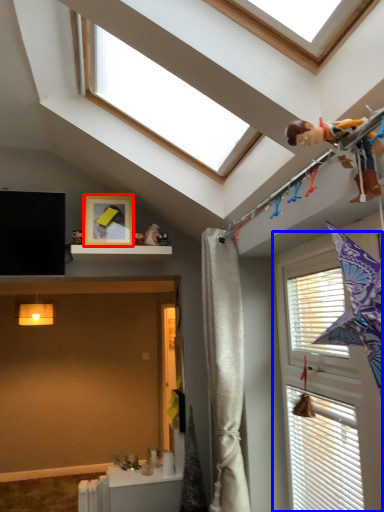
Question: Which object appears closest to the camera in this image, picture frame (highlighted by a red box) or window (highlighted by a blue box)?

Choices:
 (A) picture frame
 (B) window

Answer: (B)